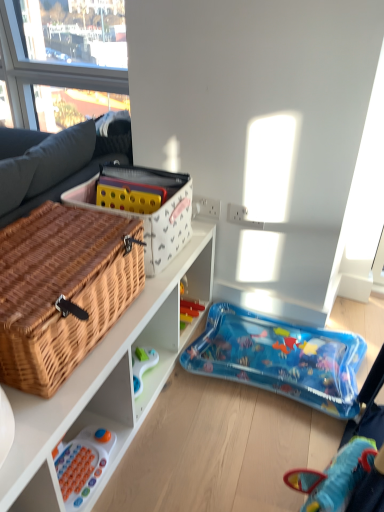
Find the location of a particular element. This screenshot has height=512, width=384. free space above woven wood cabinet at lower left (from a real-world perspective) is located at coordinates (217, 399).